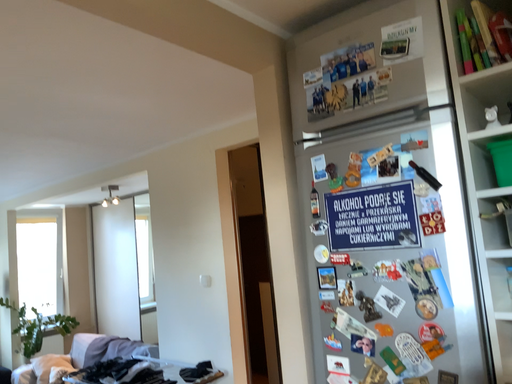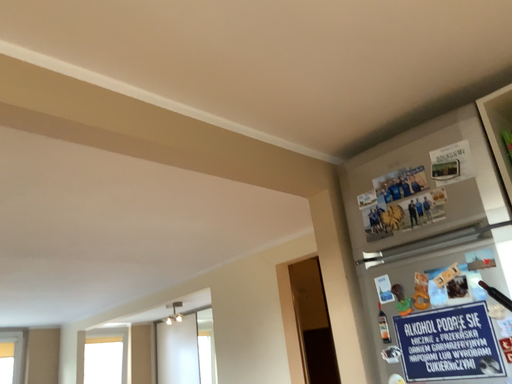
Question: Which way did the camera rotate in the video?

Choices:
 (A) rotated upward
 (B) rotated downward

Answer: (A)